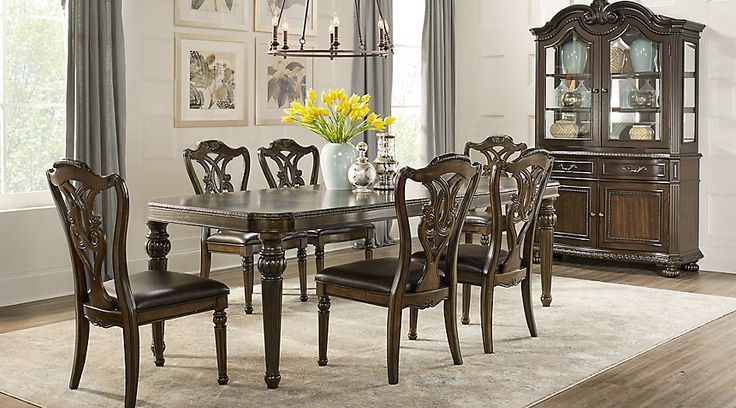
At what (x,y) coordinates should I click in order to perform the action: click on shelves. Please return your answer as a coordinate pair (x, y). Looking at the image, I should click on (620, 139), (623, 110), (620, 70), (578, 72), (584, 103), (581, 139).